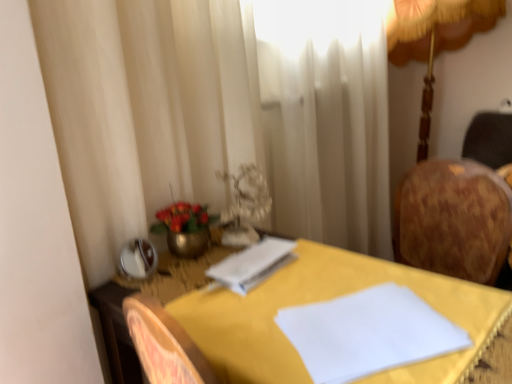
Question: Does point (240, 261) appear closer or farther from the camera than point (175, 248)?

Choices:
 (A) farther
 (B) closer

Answer: (B)

Question: Considering the positions of white paper at center and metallic gold vase at center in the image, is white paper at center bigger or smaller than metallic gold vase at center?

Choices:
 (A) small
 (B) big

Answer: (A)

Question: Based on their relative distances, which object is nearer to the gold fabric lampshade at upper right?

Choices:
 (A) metallic gold vase at center
 (B) white paper at center
 (C) yellow fabric-covered table at center

Answer: (B)

Question: Considering the real-world distances, which object is closest to the yellow fabric-covered table at center?

Choices:
 (A) gold fabric lampshade at upper right
 (B) metallic gold vase at center
 (C) white paper at center

Answer: (C)